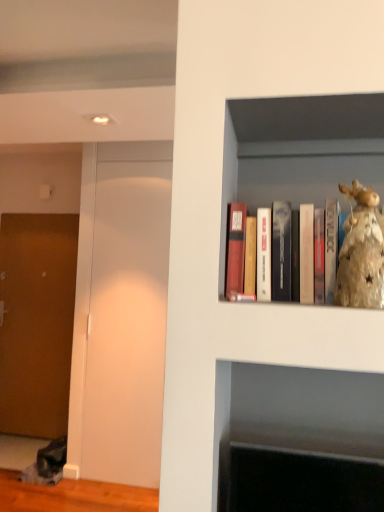
Question: From a real-world perspective, is shiny gold figurine at upper right under transparent glass door at left?

Choices:
 (A) yes
 (B) no

Answer: (B)

Question: From a real-world perspective, is shiny gold figurine at upper right over transparent glass door at left?

Choices:
 (A) yes
 (B) no

Answer: (A)

Question: Can you confirm if shiny gold figurine at upper right is bigger than transparent glass door at left?

Choices:
 (A) no
 (B) yes

Answer: (A)

Question: Is transparent glass door at left at the back of shiny gold figurine at upper right?

Choices:
 (A) yes
 (B) no

Answer: (B)

Question: Is shiny gold figurine at upper right positioned beyond the bounds of transparent glass door at left?

Choices:
 (A) yes
 (B) no

Answer: (A)

Question: From a real-world perspective, is shiny gold figurine at upper right above or below brown textured door at left?

Choices:
 (A) above
 (B) below

Answer: (A)

Question: From the image's perspective, is shiny gold figurine at upper right above or below brown textured door at left?

Choices:
 (A) below
 (B) above

Answer: (B)

Question: Is point (354, 212) positioned closer to the camera than point (8, 270)?

Choices:
 (A) farther
 (B) closer

Answer: (B)

Question: Is shiny gold figurine at upper right taller or shorter than brown textured door at left?

Choices:
 (A) tall
 (B) short

Answer: (B)

Question: Based on their positions, is matte wooden books at upper right located to the left or right of shiny gold figurine at upper right?

Choices:
 (A) right
 (B) left

Answer: (B)

Question: Looking at their shapes, would you say matte wooden books at upper right is wider or thinner than shiny gold figurine at upper right?

Choices:
 (A) thin
 (B) wide

Answer: (B)

Question: In terms of size, does matte wooden books at upper right appear bigger or smaller than shiny gold figurine at upper right?

Choices:
 (A) big
 (B) small

Answer: (A)

Question: Is matte wooden books at upper right in front of or behind shiny gold figurine at upper right in the image?

Choices:
 (A) behind
 (B) front

Answer: (A)

Question: Which is correct: shiny gold figurine at upper right is inside transparent glass door at left, or outside of it?

Choices:
 (A) inside
 (B) outside

Answer: (B)

Question: From their relative heights in the image, would you say shiny gold figurine at upper right is taller or shorter than transparent glass door at left?

Choices:
 (A) tall
 (B) short

Answer: (B)